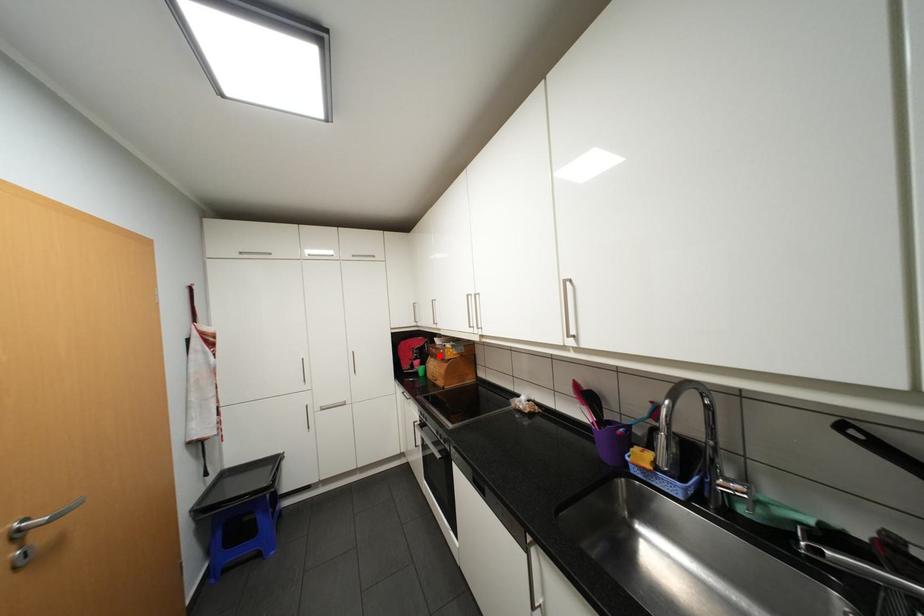
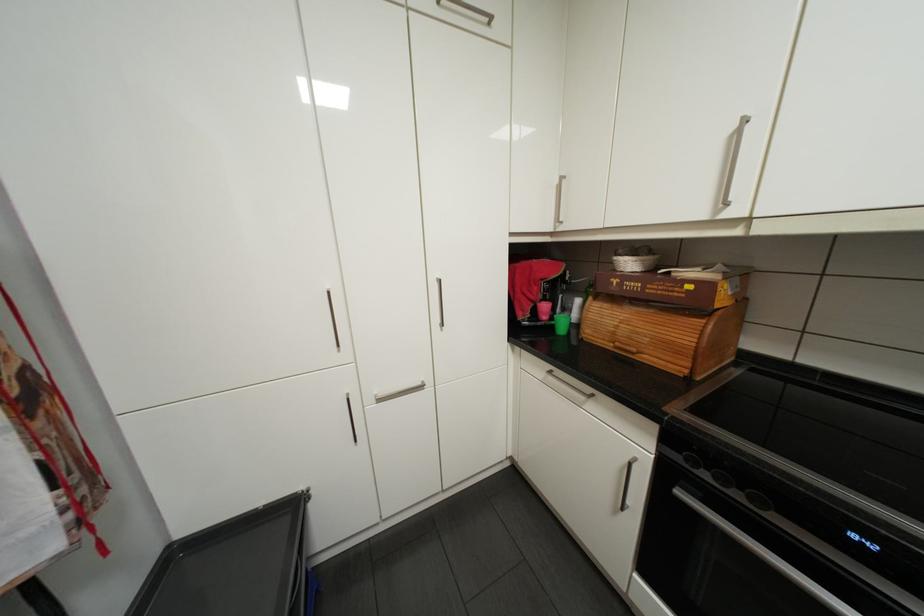
Question: I am providing you with two images of the same scene from different viewpoints. Image1 has a red point marked. In image2, the corresponding 3D location appears at what relative position? Reply with the corresponding letter.

Choices:
 (A) Closer
 (B) Farther

Answer: (A)